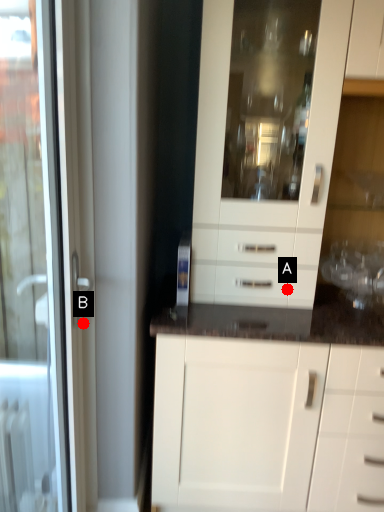
Question: Two points are circled on the image, labeled by A and B beside each circle. Which point is closer to the camera?

Choices:
 (A) A is closer
 (B) B is closer

Answer: (B)